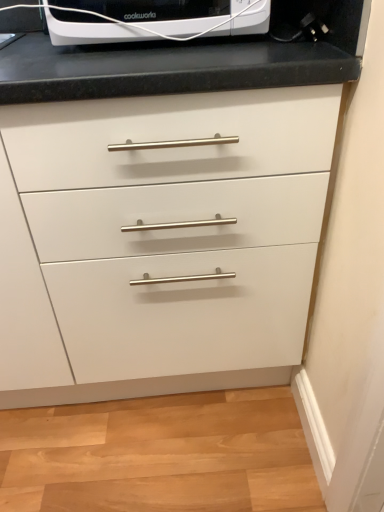
What do you see at coordinates (160, 242) in the screenshot?
I see `white matte cabinet at center` at bounding box center [160, 242].

Locate an element on the screen. The height and width of the screenshot is (512, 384). white matte cabinet at center is located at coordinates (160, 242).

What is the approximate height of white matte cabinet at center?

white matte cabinet at center is 35.95 inches in height.

Where is `white glossy appliance at upper center`? Image resolution: width=384 pixels, height=512 pixels. white glossy appliance at upper center is located at coordinates (152, 19).

The width and height of the screenshot is (384, 512). Describe the element at coordinates (152, 19) in the screenshot. I see `white glossy appliance at upper center` at that location.

The image size is (384, 512). Find the location of `white matte cabinet at center`. white matte cabinet at center is located at coordinates (160, 242).

Considering the positions of objects white matte cabinet at center and white glossy appliance at upper center in the image provided, who is more to the right, white matte cabinet at center or white glossy appliance at upper center?

white glossy appliance at upper center is more to the right.

Which object is closer to the camera, white matte cabinet at center or white glossy appliance at upper center?

white matte cabinet at center is closer to the camera.

Between point (128, 161) and point (93, 12), which one is positioned behind?

The point (93, 12) is farther.

From the picture: From the image's perspective, relative to white glossy appliance at upper center, is white matte cabinet at center above or below?

From the image's perspective, white matte cabinet at center appears below white glossy appliance at upper center.

From a real-world perspective, which is physically below, white matte cabinet at center or white glossy appliance at upper center?

white matte cabinet at center.

Considering the sizes of objects white matte cabinet at center and white glossy appliance at upper center in the image provided, who is wider, white matte cabinet at center or white glossy appliance at upper center?

white matte cabinet at center is wider.

Who is shorter, white matte cabinet at center or white glossy appliance at upper center?

white glossy appliance at upper center is shorter.

In terms of size, does white matte cabinet at center appear bigger or smaller than white glossy appliance at upper center?

white matte cabinet at center is bigger than white glossy appliance at upper center.

Is white matte cabinet at center situated inside white glossy appliance at upper center or outside?

white matte cabinet at center exists outside the volume of white glossy appliance at upper center.

Would you consider white matte cabinet at center to be distant from white glossy appliance at upper center?

No.

Is white matte cabinet at center facing towards white glossy appliance at upper center?

No.

How many degrees apart are the facing directions of white matte cabinet at center and white glossy appliance at upper center?

The angle between the facing direction of white matte cabinet at center and the facing direction of white glossy appliance at upper center is 1.2 degrees.

How distant is white matte cabinet at center from white glossy appliance at upper center?

16.56 inches.

Where is `home appliance located above the white matte cabinet at center (from a real-world perspective)`? home appliance located above the white matte cabinet at center (from a real-world perspective) is located at coordinates (152, 19).

Between white glossy appliance at upper center and white matte cabinet at center, which one appears on the left side from the viewer's perspective?

Positioned to the left is white matte cabinet at center.

Does white glossy appliance at upper center lie in front of white matte cabinet at center?

No, it is not.

Which point is more distant from viewer, (186, 26) or (247, 281)?

The point (247, 281) is farther.

From the image's perspective, would you say white glossy appliance at upper center is positioned over white matte cabinet at center?

Correct, white glossy appliance at upper center appears higher than white matte cabinet at center in the image.

Based on the photo, from a real-world perspective, is white glossy appliance at upper center below white matte cabinet at center?

No, from a real-world perspective, white glossy appliance at upper center is not under white matte cabinet at center.

Between white glossy appliance at upper center and white matte cabinet at center, which one has larger width?

white matte cabinet at center is wider.

Who is shorter, white glossy appliance at upper center or white matte cabinet at center?

Standing shorter between the two is white glossy appliance at upper center.

In terms of size, does white glossy appliance at upper center appear bigger or smaller than white matte cabinet at center?

In the image, white glossy appliance at upper center appears to be smaller than white matte cabinet at center.

Looking at this image, would you say white glossy appliance at upper center is inside or outside white matte cabinet at center?

The correct answer is: outside.

Is white glossy appliance at upper center placed right next to white matte cabinet at center?

No, white glossy appliance at upper center is not next to white matte cabinet at center.

Could you tell me if white glossy appliance at upper center is facing white matte cabinet at center?

No, white glossy appliance at upper center is not aimed at white matte cabinet at center.

How much distance is there between white glossy appliance at upper center and white matte cabinet at center?

white glossy appliance at upper center and white matte cabinet at center are 42.06 centimeters apart from each other.

Find the location of a particular element. home appliance that appears on the right of white matte cabinet at center is located at coordinates (152, 19).

I want to click on chest of drawers on the left of white glossy appliance at upper center, so click(x=160, y=242).

Locate an element on the screen. home appliance located above the white matte cabinet at center (from a real-world perspective) is located at coordinates (152, 19).